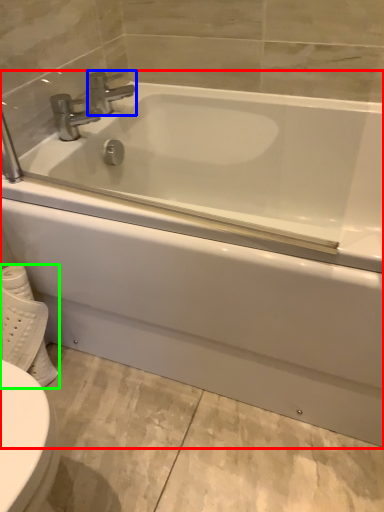
Question: Which is farther away from bathtub (highlighted by a red box)? tap (highlighted by a blue box) or toilet paper (highlighted by a green box)?

Choices:
 (A) tap
 (B) toilet paper

Answer: (A)